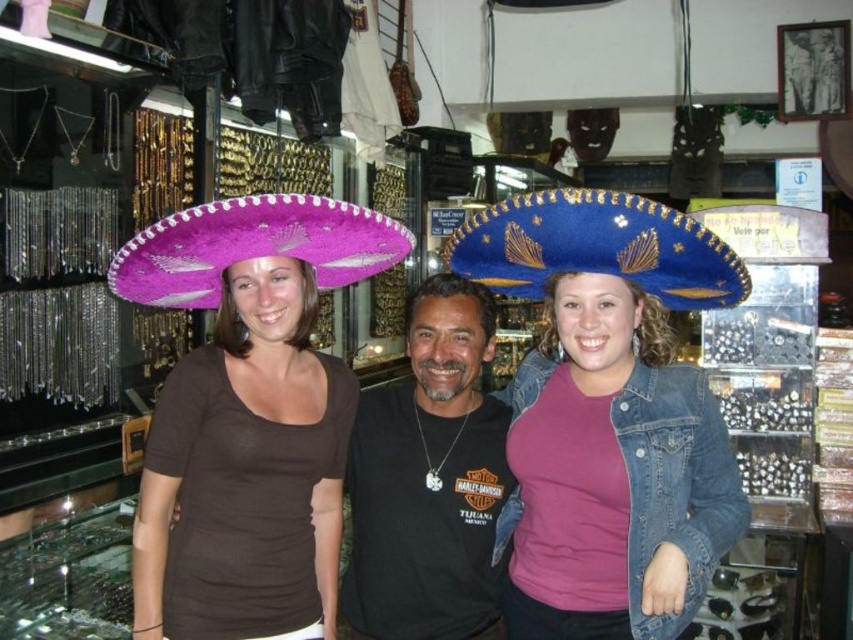
Who is more forward, (648, 230) or (154, 228)?

Point (648, 230) is in front.

Who is shorter, blue felt sombrero at center or pink felt sombrero at left?

blue felt sombrero at center is shorter.

Consider the image. Who is more distant from viewer, (x=619, y=273) or (x=283, y=240)?

The point (x=619, y=273) is behind.

I want to click on blue felt sombrero at center, so click(596, 248).

Is blue denim jacket at center shorter than matte pink fabric sombrero at upper left?

Indeed, blue denim jacket at center has a lesser height compared to matte pink fabric sombrero at upper left.

Is blue denim jacket at center positioned before matte pink fabric sombrero at upper left?

Yes, blue denim jacket at center is in front of matte pink fabric sombrero at upper left.

Between point (607, 515) and point (171, 392), which one is positioned behind?

The point (607, 515) is behind.

At what (x,y) coordinates should I click in order to perform the action: click on blue denim jacket at center. Please return your answer as a coordinate pair (x, y). The height and width of the screenshot is (640, 853). Looking at the image, I should click on (613, 474).

Can you confirm if blue denim jacket at center is positioned to the right of blue felt sombrero at center?

Indeed, blue denim jacket at center is positioned on the right side of blue felt sombrero at center.

Which of these two, blue denim jacket at center or blue felt sombrero at center, stands taller?

With more height is blue denim jacket at center.

Which is in front, point (566, 637) or point (637, 282)?

Point (637, 282) is more forward.

At what (x,y) coordinates should I click in order to perform the action: click on blue denim jacket at center. Please return your answer as a coordinate pair (x, y). Looking at the image, I should click on (613, 474).